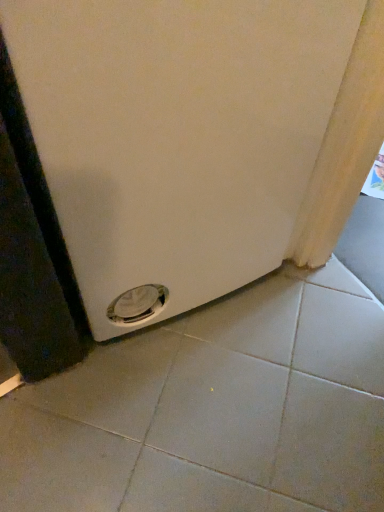
The width and height of the screenshot is (384, 512). What do you see at coordinates (196, 139) in the screenshot?
I see `white glossy refrigerator at center` at bounding box center [196, 139].

Locate an element on the screen. The width and height of the screenshot is (384, 512). white glossy refrigerator at center is located at coordinates (196, 139).

This screenshot has width=384, height=512. I want to click on white glossy refrigerator at center, so click(x=196, y=139).